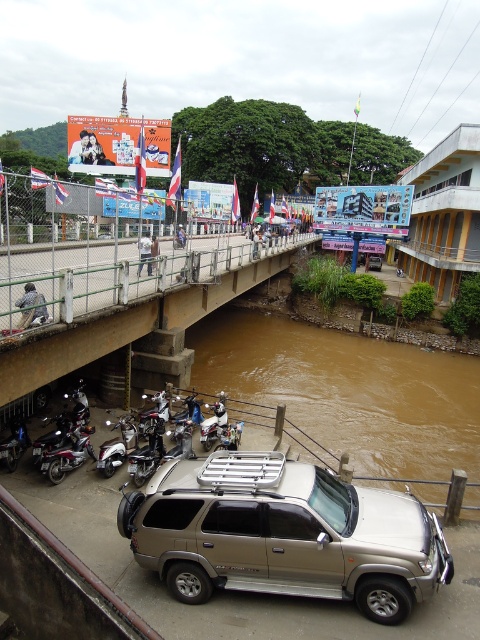
Does silver metallic suv at center have a smaller size compared to brown concrete bridge at lower left?

Yes.

Does silver metallic suv at center have a lesser height compared to brown concrete bridge at lower left?

Yes.

Where is `silver metallic suv at center`? silver metallic suv at center is located at coordinates (284, 532).

From the picture: Which of these two, brown muddy water at lower center or brown concrete bridge at lower left, stands taller?

brown muddy water at lower center is taller.

Who is more distant from viewer, (x=352, y=365) or (x=160, y=305)?

Point (x=352, y=365)

Which is behind, point (432, 444) or point (225, 278)?

Point (225, 278)

Find the location of a particular element. The image size is (480, 640). brown muddy water at lower center is located at coordinates (351, 394).

Between silver metallic suv at center and brown muddy water at lower center, which one has more height?

Standing taller between the two is brown muddy water at lower center.

Is point (255, 573) positioned before point (395, 376)?

Yes, point (255, 573) is in front of point (395, 376).

Based on the photo, who is more distant from viewer, (302, 493) or (380, 369)?

Positioned behind is point (380, 369).

Where is `silver metallic suv at center`? This screenshot has height=640, width=480. silver metallic suv at center is located at coordinates (284, 532).